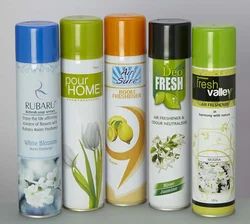
I want to click on left canister, so click(x=41, y=122).